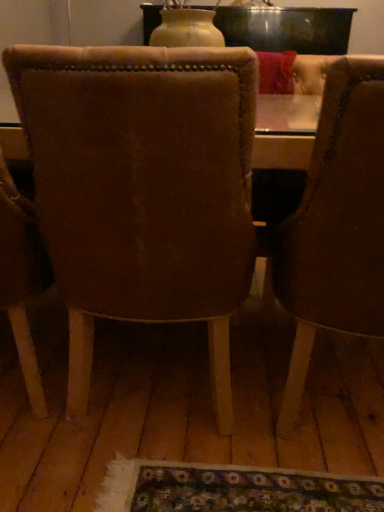
Question: Would you say brown leather chair at right, the 1th chair in the right-to-left sequence, is to the left or to the right of suede-like brown chair at center, which is the 1th chair from left to right, in the picture?

Choices:
 (A) right
 (B) left

Answer: (A)

Question: Looking at their shapes, would you say brown leather chair at right, which is the 2th chair in left-to-right order, is wider or thinner than suede-like brown chair at center, the second chair in the right-to-left sequence?

Choices:
 (A) wide
 (B) thin

Answer: (A)

Question: Considering the positions of brown leather chair at right, the 1th chair in the right-to-left sequence, and suede-like brown chair at center, which is the 1th chair from left to right, in the image, is brown leather chair at right, the 1th chair in the right-to-left sequence, bigger or smaller than suede-like brown chair at center, which is the 1th chair from left to right,?

Choices:
 (A) small
 (B) big

Answer: (B)

Question: Is point (120, 72) closer or farther from the camera than point (362, 209)?

Choices:
 (A) closer
 (B) farther

Answer: (A)

Question: In the image, is suede-like brown chair at center, which is the 1th chair from left to right, positioned in front of or behind brown leather chair at right, the 1th chair in the right-to-left sequence?

Choices:
 (A) behind
 (B) front

Answer: (A)

Question: Considering the positions of suede-like brown chair at center, the second chair in the right-to-left sequence, and brown leather chair at right, which is the 2th chair in left-to-right order, in the image, is suede-like brown chair at center, the second chair in the right-to-left sequence, taller or shorter than brown leather chair at right, which is the 2th chair in left-to-right order,?

Choices:
 (A) short
 (B) tall

Answer: (B)

Question: Based on their positions, is suede-like brown chair at center, which is the 1th chair from left to right, located to the left or right of brown leather chair at right, which is the 2th chair in left-to-right order?

Choices:
 (A) right
 (B) left

Answer: (B)